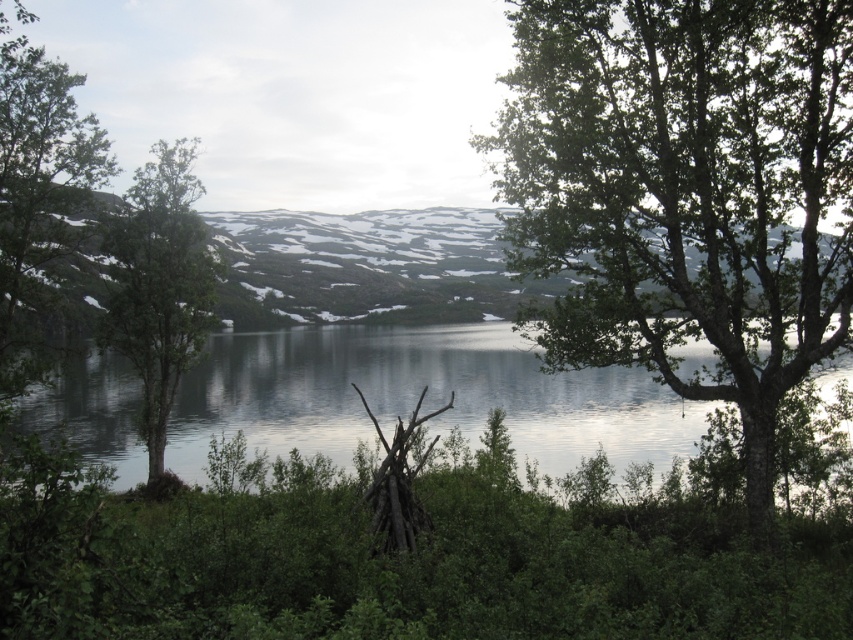
You are standing at the point marked as point (231, 276) in the image. The lake in the middle ground is 100 meters long. If you walk straight towards the far end of the lake, how far will you have to walk?

Since you are 79.51 meters away from point (231, 276), which is your current position, and the lake is 100 meters long, you would need to walk approximately 79.51 meters to reach the far end of the lake.

You are planning to take a photo of the snowy rock mountain at center and the green leafy tree at left. Which object should you focus on first if you want to capture both in a single shot without moving the camera?

The snowy rock mountain at center is larger in size than the green leafy tree at left, so you should focus on the snowy rock mountain at center first to ensure it fills the frame appropriately before adjusting for the smaller tree.